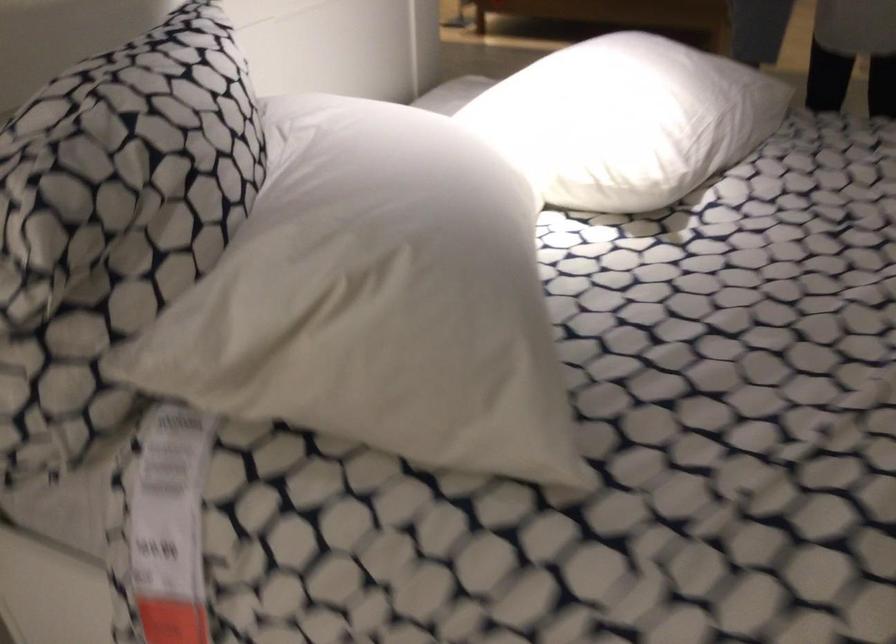
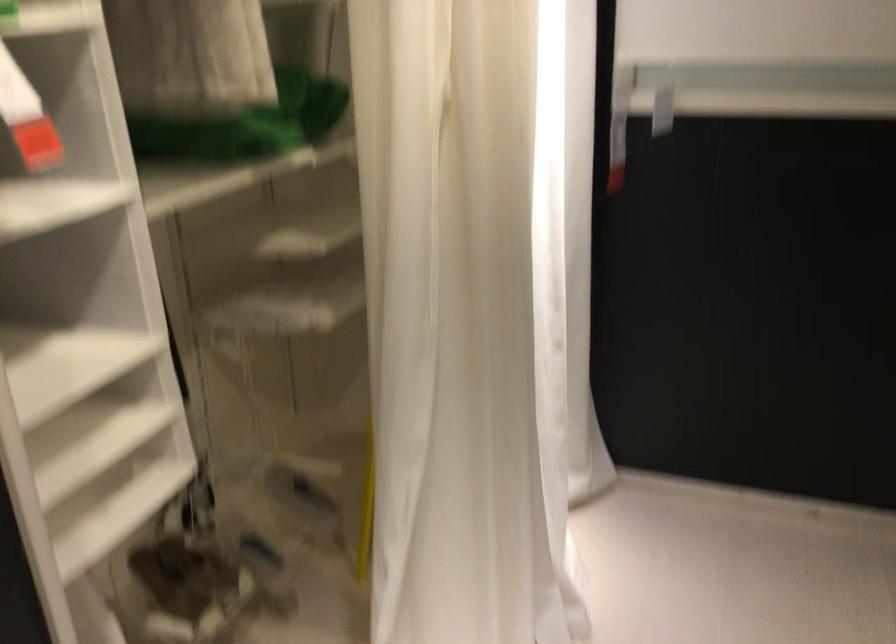
From the picture: First-person continuous shooting, in which direction is the camera rotating?

The camera rotated toward left-down.